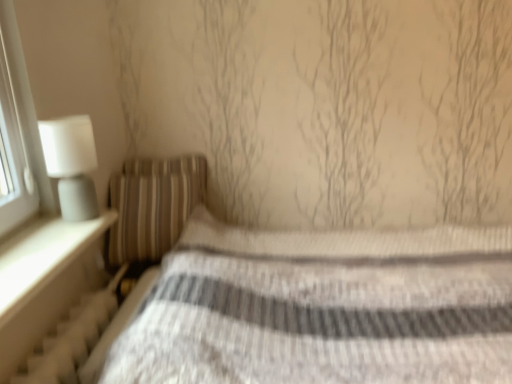
Question: Is white matte table lamp at left far away from striped fabric pillow at left?

Choices:
 (A) yes
 (B) no

Answer: (B)

Question: From a real-world perspective, is white matte table lamp at left located beneath striped fabric pillow at left?

Choices:
 (A) no
 (B) yes

Answer: (A)

Question: From the image's perspective, would you say white matte table lamp at left is shown under striped fabric pillow at left?

Choices:
 (A) no
 (B) yes

Answer: (A)

Question: Does white matte table lamp at left have a larger size compared to striped fabric pillow at left?

Choices:
 (A) no
 (B) yes

Answer: (A)

Question: Does white matte table lamp at left come in front of striped fabric pillow at left?

Choices:
 (A) no
 (B) yes

Answer: (B)

Question: Which is correct: striped fabric bed at center is inside white textured radiator at lower left, or outside of it?

Choices:
 (A) outside
 (B) inside

Answer: (A)

Question: Is striped fabric bed at center taller or shorter than white textured radiator at lower left?

Choices:
 (A) short
 (B) tall

Answer: (B)

Question: From the image's perspective, relative to white textured radiator at lower left, is striped fabric bed at center above or below?

Choices:
 (A) below
 (B) above

Answer: (A)

Question: In the image, is striped fabric bed at center on the left side or the right side of white textured radiator at lower left?

Choices:
 (A) left
 (B) right

Answer: (B)

Question: Is white matte table lamp at left bigger or smaller than striped fabric pillow at left?

Choices:
 (A) big
 (B) small

Answer: (B)

Question: In the image, is white matte table lamp at left positioned in front of or behind striped fabric pillow at left?

Choices:
 (A) front
 (B) behind

Answer: (A)

Question: In terms of width, does white matte table lamp at left look wider or thinner when compared to striped fabric pillow at left?

Choices:
 (A) thin
 (B) wide

Answer: (A)

Question: From a real-world perspective, is white matte table lamp at left above or below striped fabric pillow at left?

Choices:
 (A) above
 (B) below

Answer: (A)

Question: Is point (91, 322) closer or farther from the camera than point (144, 165)?

Choices:
 (A) closer
 (B) farther

Answer: (A)

Question: Which is correct: white textured radiator at lower left is inside striped fabric pillow at left, or outside of it?

Choices:
 (A) inside
 (B) outside

Answer: (B)